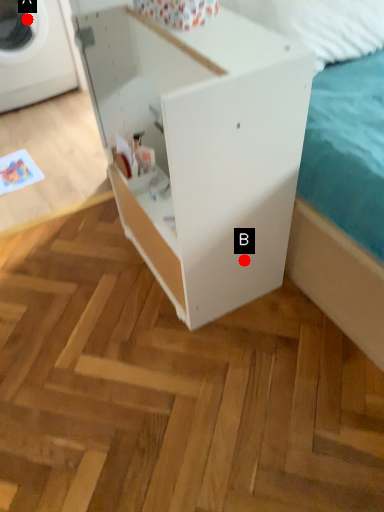
Question: Two points are circled on the image, labeled by A and B beside each circle. Among these points, which one is farthest from the camera?

Choices:
 (A) A is further
 (B) B is further

Answer: (A)